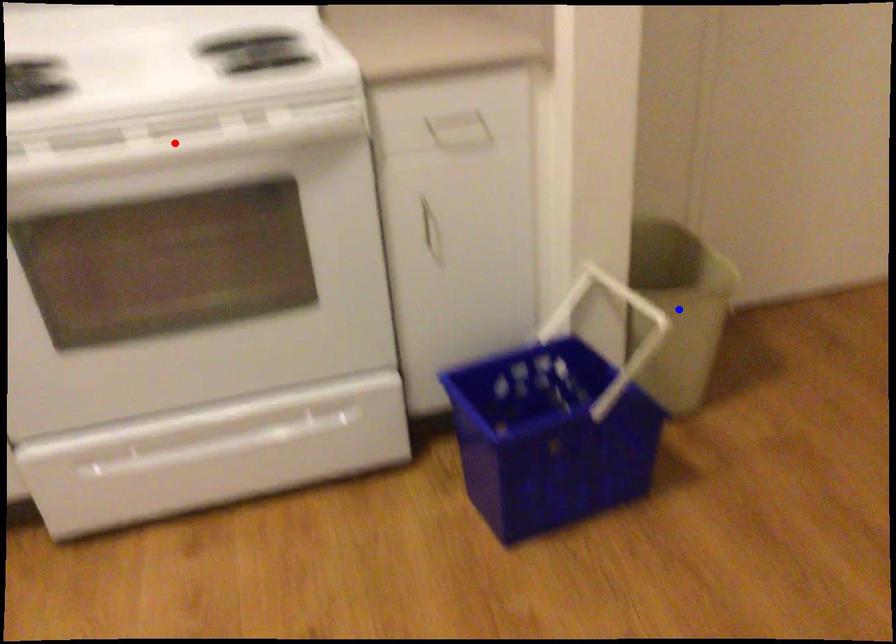
Question: Which of the two points in the image is closer to the camera?

Choices:
 (A) Blue point is closer.
 (B) Red point is closer.

Answer: (B)